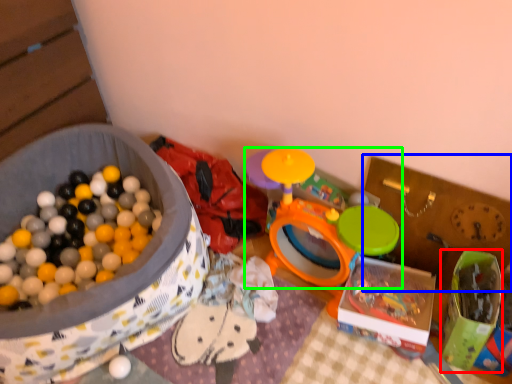
Question: Estimate the real-world distances between objects in this image. Which object is farther from box (highlighted by a red box), storage box (highlighted by a blue box) or toy (highlighted by a green box)?

Choices:
 (A) storage box
 (B) toy

Answer: (B)